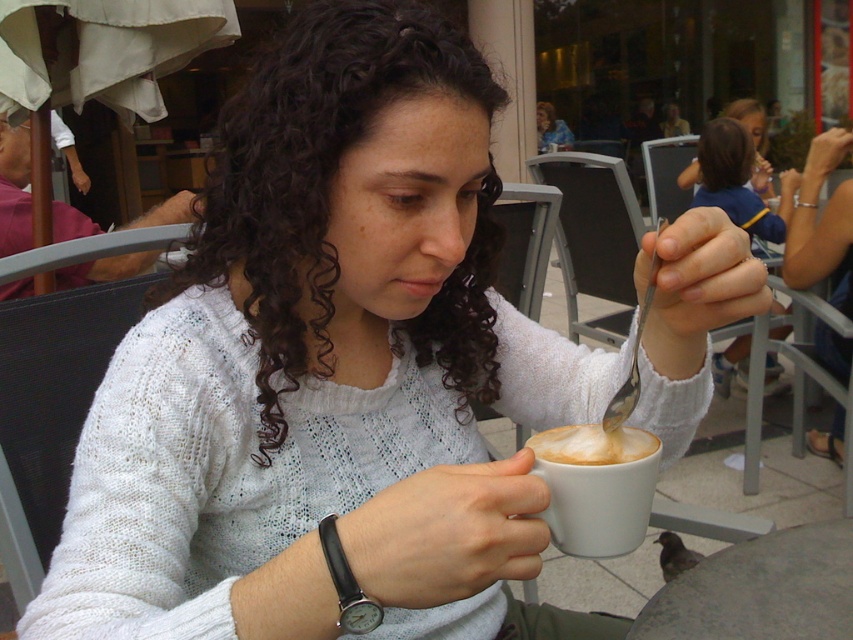
Which is behind, point (763, 604) or point (643, 308)?

The point (763, 604) is more distant.

Who is taller, smooth stone table at lower right or silver metallic spoon at upper center?

silver metallic spoon at upper center is taller.

Image resolution: width=853 pixels, height=640 pixels. Find the location of `smooth stone table at lower right`. smooth stone table at lower right is located at coordinates (759, 589).

Is white matte cup at center above white knitted sweater at upper center?

No, white matte cup at center is not above white knitted sweater at upper center.

Can you confirm if white matte cup at center is bigger than white knitted sweater at upper center?

Incorrect, white matte cup at center is not larger than white knitted sweater at upper center.

Which is behind, point (631, 516) or point (712, 144)?

Point (712, 144)

Find the location of a particular element. white matte cup at center is located at coordinates (596, 486).

Does smooth stone table at lower right have a greater height compared to matte white sweater at center?

Incorrect, smooth stone table at lower right's height is not larger of matte white sweater at center's.

Who is positioned more to the right, smooth stone table at lower right or matte white sweater at center?

matte white sweater at center is more to the right.

The height and width of the screenshot is (640, 853). What do you see at coordinates (759, 589) in the screenshot?
I see `smooth stone table at lower right` at bounding box center [759, 589].

You are a GUI agent. You are given a task and a screenshot of the screen. Output one action in this format:
    pyautogui.click(x=<x>, y=<y>)
    Task: Click on the smooth stone table at lower right
    
    Given the screenshot: What is the action you would take?
    pyautogui.click(x=759, y=589)